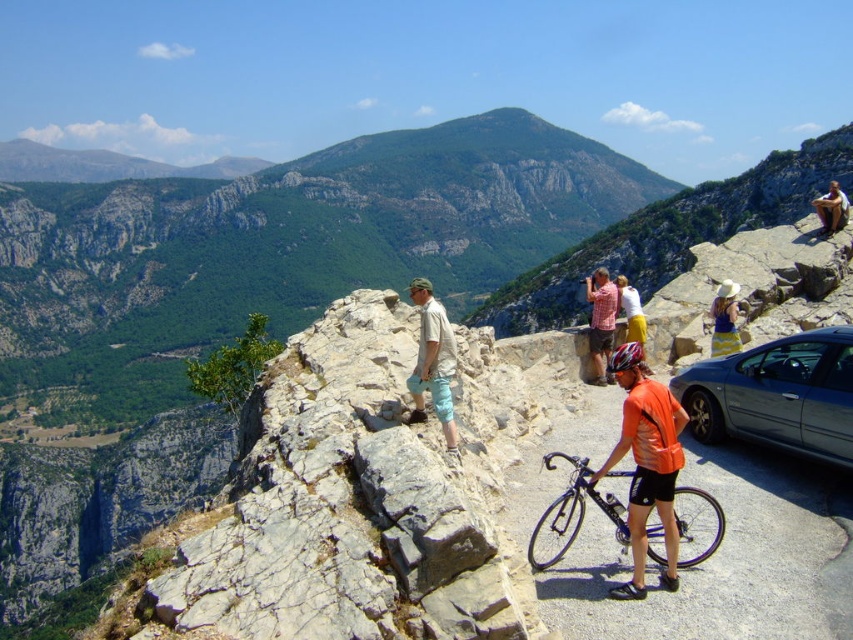
Is orange fabric cyclist at center positioned in front of yellow striped dress at center?

Yes.

Between orange fabric cyclist at center and yellow striped dress at center, which one appears on the right side from the viewer's perspective?

Positioned to the right is yellow striped dress at center.

Image resolution: width=853 pixels, height=640 pixels. What are the coordinates of `orange fabric cyclist at center` in the screenshot? It's located at (646, 461).

In the scene shown: Does orange fabric cyclist at center have a smaller size compared to matte pink shirt at center?

Yes.

Does orange fabric cyclist at center appear on the right side of matte pink shirt at center?

Incorrect, orange fabric cyclist at center is not on the right side of matte pink shirt at center.

Image resolution: width=853 pixels, height=640 pixels. Describe the element at coordinates (646, 461) in the screenshot. I see `orange fabric cyclist at center` at that location.

Find the location of a particular element. This screenshot has width=853, height=640. orange fabric cyclist at center is located at coordinates (646, 461).

Consider the image. Between gray rock at upper center and light blue denim shorts at center, which one is positioned lower?

gray rock at upper center

Can you confirm if gray rock at upper center is positioned below light blue denim shorts at center?

Indeed, gray rock at upper center is positioned under light blue denim shorts at center.

Who is more distant from viewer, (341, 314) or (410, 376)?

The point (341, 314) is behind.

The width and height of the screenshot is (853, 640). I want to click on gray rock at upper center, so click(358, 500).